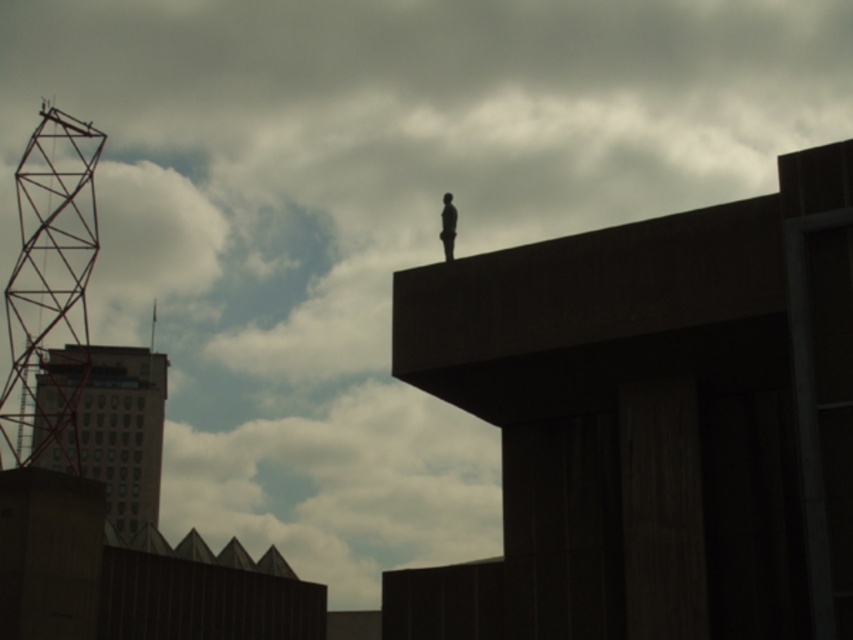
Based on the photo, can you confirm if gray concrete building at left is wider than silhouette figure at upper center?

Yes, gray concrete building at left is wider than silhouette figure at upper center.

In the scene shown: Who is more forward, (135, 396) or (450, 244)?

Positioned in front is point (450, 244).

Which is in front, point (122, 493) or point (453, 241)?

Point (453, 241) is more forward.

Where is `gray concrete building at left`? Image resolution: width=853 pixels, height=640 pixels. gray concrete building at left is located at coordinates (125, 432).